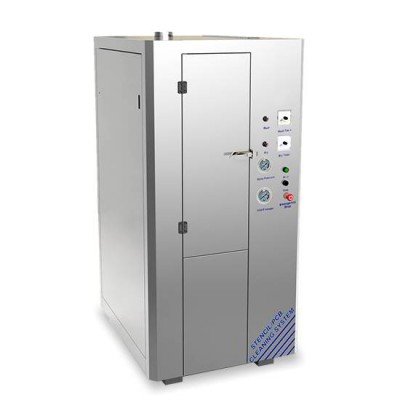
This screenshot has height=400, width=400. In order to click on access panels in this screenshot , I will do `click(121, 151)`, `click(213, 155)`, `click(235, 314)`.